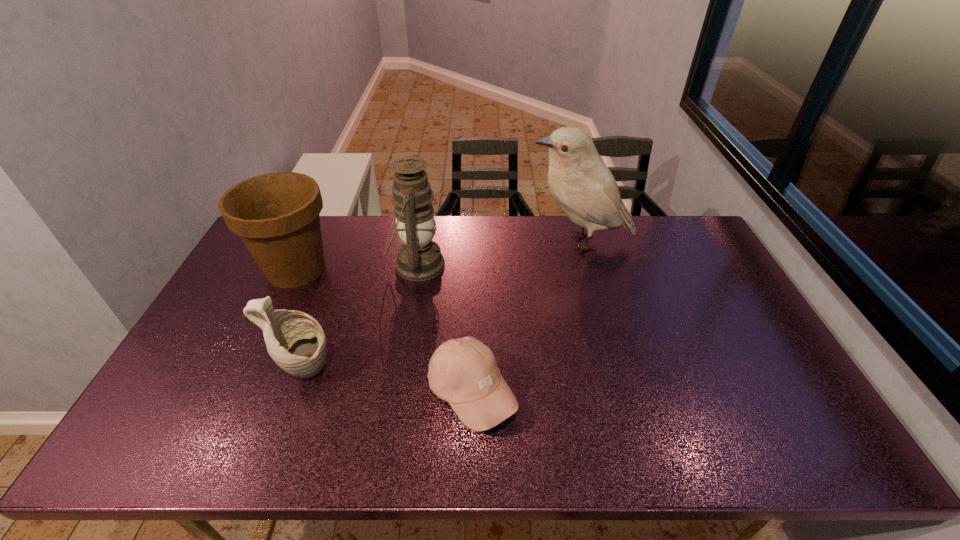
Locate an element on the screen. empty location between the baseball cap and the parakeet is located at coordinates (526, 318).

The height and width of the screenshot is (540, 960). I want to click on free spot between the shortest object and the rightmost object, so click(526, 318).

Point out which object is positioned as the third nearest to the pitcher. Please provide its 2D coordinates. Your answer should be formatted as a tuple, i.e. [(x, y)], where the tuple contains the x and y coordinates of a point satisfying the conditions above.

[(464, 372)]

This screenshot has width=960, height=540. I want to click on object that is the closest to the rightmost object, so click(x=419, y=258).

Image resolution: width=960 pixels, height=540 pixels. Identify the location of vacant area that satisfies the following two spatial constraints: 1. on the front side of the oil lamp; 2. at the spout of the pitcher. (400, 371).